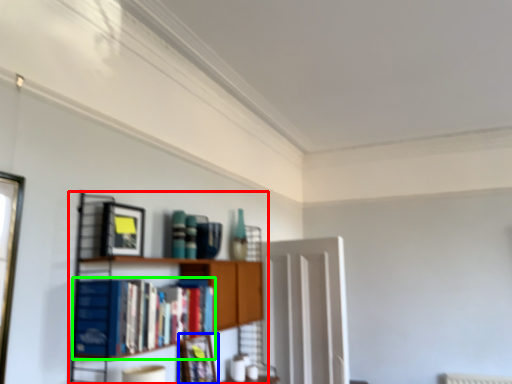
Question: Considering the real-world distances, which object is farthest from shelf (highlighted by a red box)? picture frame (highlighted by a blue box) or book (highlighted by a green box)?

Choices:
 (A) picture frame
 (B) book

Answer: (A)